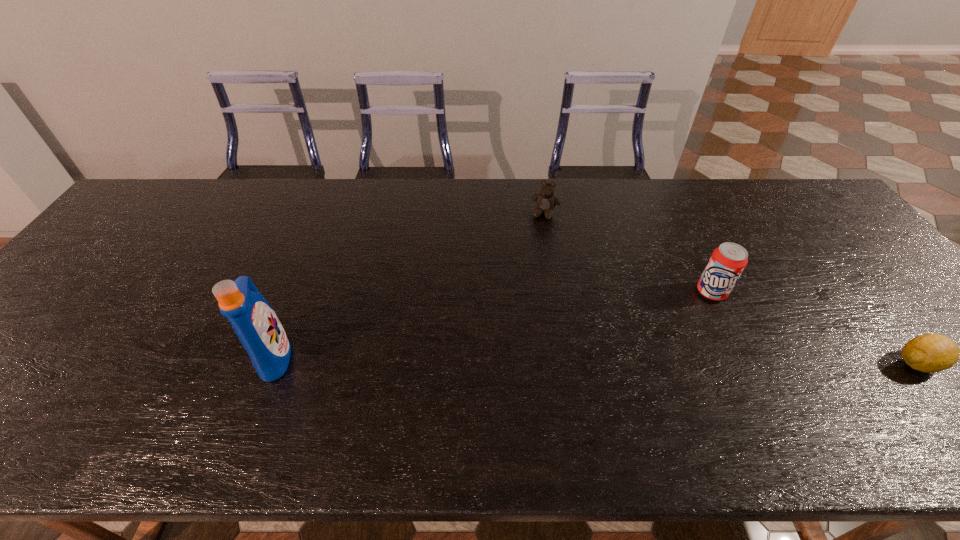
The height and width of the screenshot is (540, 960). What are the coordinates of `vacant space at the far edge of the desktop` in the screenshot? It's located at (658, 212).

The height and width of the screenshot is (540, 960). I want to click on vacant space at the near edge of the desktop, so click(x=101, y=390).

The image size is (960, 540). Find the location of `free space at the left edge of the desktop`. free space at the left edge of the desktop is located at coordinates (130, 238).

The height and width of the screenshot is (540, 960). In order to click on free space at the right edge in this screenshot , I will do `click(897, 355)`.

This screenshot has width=960, height=540. In the image, there is a desktop. In order to click on free space at the far left corner in this screenshot , I will do `click(184, 205)`.

You are a GUI agent. You are given a task and a screenshot of the screen. Output one action in this format:
    pyautogui.click(x=<x>, y=<y>)
    Task: Click on the blank area at the near left corner
    The width and height of the screenshot is (960, 540).
    Given the screenshot: What is the action you would take?
    pyautogui.click(x=29, y=397)

Locate an element on the screen. The height and width of the screenshot is (540, 960). vacant area that lies between the shortest object and the soda can is located at coordinates (815, 327).

Image resolution: width=960 pixels, height=540 pixels. In order to click on free space between the leftmost object and the third shortest object in this screenshot , I will do `click(493, 323)`.

Locate an element on the screen. The height and width of the screenshot is (540, 960). vacant area that lies between the third nearest object and the detergent is located at coordinates (493, 323).

At what (x,y) coordinates should I click in order to perform the action: click on free spot between the third object from right to left and the soda can. Please return your answer as a coordinate pair (x, y). Looking at the image, I should click on point(629,253).